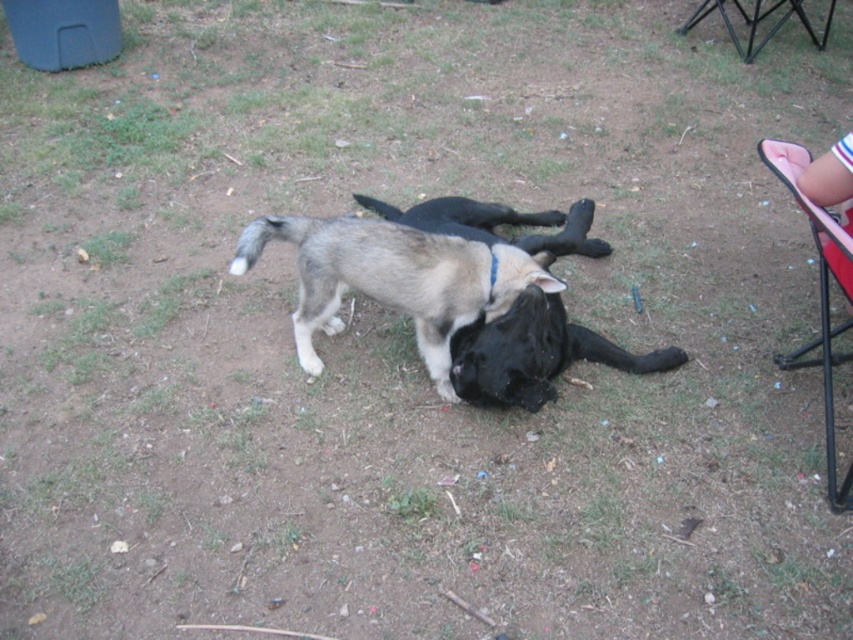
You are a photographer trying to capture a closeup of the black fur dog at center and the black metal chair at upper right. Which object should you focus on first to ensure it appears sharp in your photo?

The black fur dog at center is closer to the viewer than the black metal chair at upper right, so you should focus on the black fur dog at center first to ensure it appears sharp.

You are a dog owner who wants to separate your two dogs. You see the gray fur dog at center and the black matte dog at center. Which dog should you approach first to move them apart?

You should approach the gray fur dog at center first because it is in front of the black matte dog at center and easier to reach.

You are a photographer positioned at the edge of the grassy area. You want to take a picture of both the black matte dog at center and the black metal chair at upper right. Which object will appear larger in your photo?

The black matte dog at center will appear larger in the photo because it is closer to the viewer than the black metal chair at upper right.